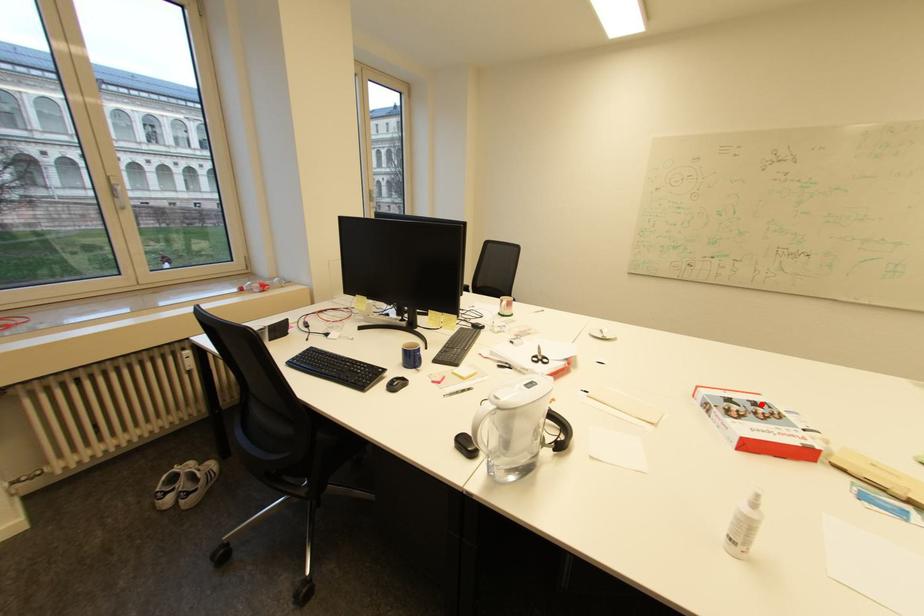
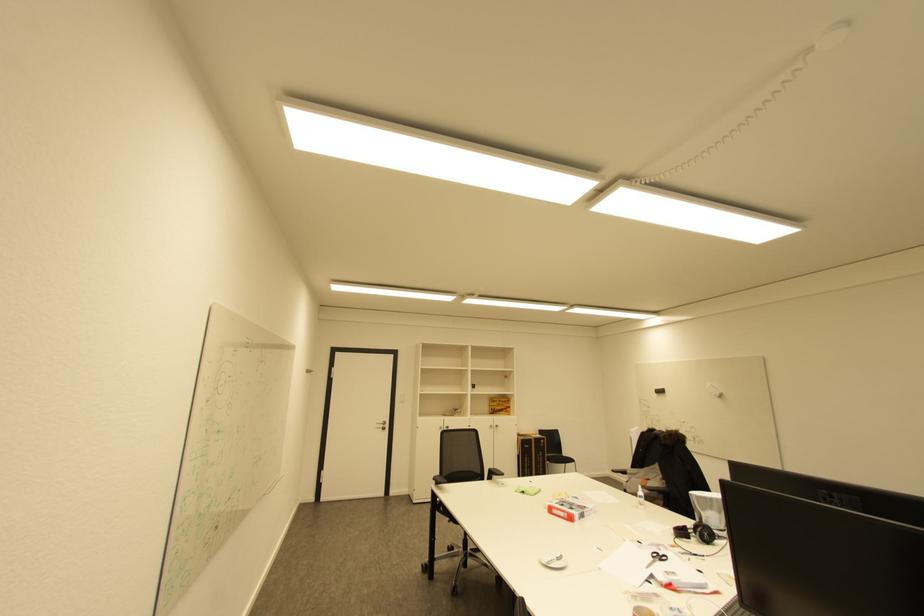
Where in the second image is the point corresponding to the highlighted location from the first image?

(568, 506)